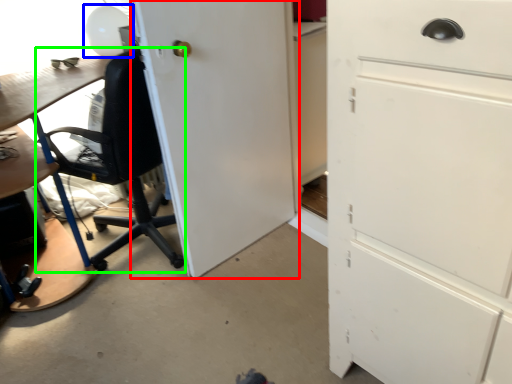
Question: Based on their relative distances, which object is farther from door (highlighted by a red box)? Choose from table lamp (highlighted by a blue box) and chair (highlighted by a green box).

Choices:
 (A) table lamp
 (B) chair

Answer: (A)